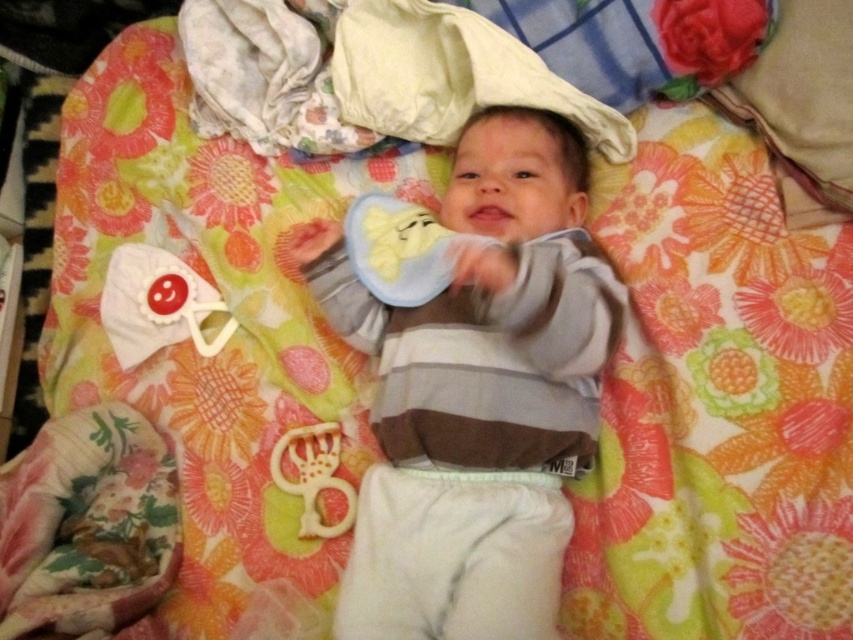
Can you confirm if white fabric toy at upper left is positioned to the left of white plastic teething ring at lower center?

Indeed, white fabric toy at upper left is positioned on the left side of white plastic teething ring at lower center.

Which is in front, point (129, 328) or point (352, 502)?

Point (352, 502)

This screenshot has height=640, width=853. What do you see at coordinates (158, 305) in the screenshot? I see `white fabric toy at upper left` at bounding box center [158, 305].

Find the location of a particular element. The height and width of the screenshot is (640, 853). white fabric toy at upper left is located at coordinates coord(158,305).

Is point (451, 112) closer to viewer compared to point (328, 449)?

No.

Is white fabric pillow at upper center to the left of white plastic teething ring at lower center from the viewer's perspective?

Incorrect, white fabric pillow at upper center is not on the left side of white plastic teething ring at lower center.

Find the location of a particular element. white fabric pillow at upper center is located at coordinates (450, 76).

Which is behind, point (509, 77) or point (155, 308)?

Point (155, 308)

Does point (634, 140) lie in front of point (155, 256)?

That is True.

Where is `white fabric pillow at upper center`? The height and width of the screenshot is (640, 853). white fabric pillow at upper center is located at coordinates (450, 76).